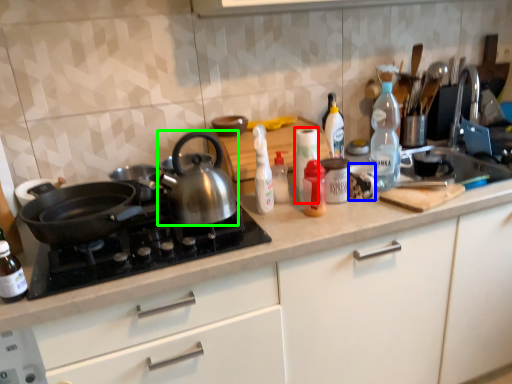
Question: Which object is the closest to the bottle (highlighted by a red box)? Choose among these: tableware (highlighted by a blue box) or kettle (highlighted by a green box).

Choices:
 (A) tableware
 (B) kettle

Answer: (A)